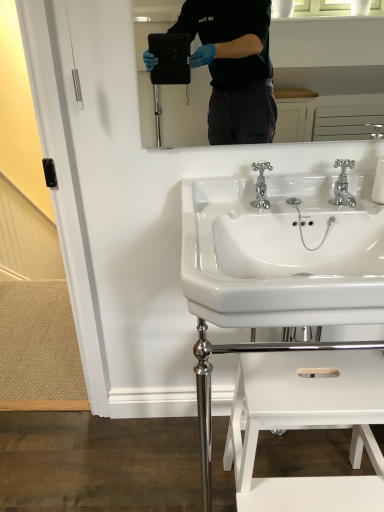
Question: Is white glossy sink at center, acting as the 2th sink starting from the bottom, taller or shorter than white glossy step stool at lower center?

Choices:
 (A) short
 (B) tall

Answer: (A)

Question: Based on their positions, is white glossy sink at center, acting as the 2th sink starting from the bottom, located to the left or right of white glossy step stool at lower center?

Choices:
 (A) left
 (B) right

Answer: (A)

Question: Estimate the real-world distances between objects in this image. Which object is farther from the white glossy sink at center, arranged as the 1th sink when viewed from the top?

Choices:
 (A) chrome metallic faucet at center, the second tap when ordered from right to left
 (B) chrome metallic faucet at upper right, which appears as the second tap when viewed from the left
 (C) white glossy sink at center, arranged as the 2th sink when viewed from the top
 (D) white glossy step stool at lower center

Answer: (D)

Question: Estimate the real-world distances between objects in this image. Which object is farther from the chrome metallic faucet at center, which is the 1th tap from left to right?

Choices:
 (A) white glossy step stool at lower center
 (B) white glossy sink at center, acting as the 2th sink starting from the bottom
 (C) chrome metallic faucet at upper right, which appears as the second tap when viewed from the left
 (D) white glossy sink at center, the first sink when ordered from bottom to top

Answer: (A)